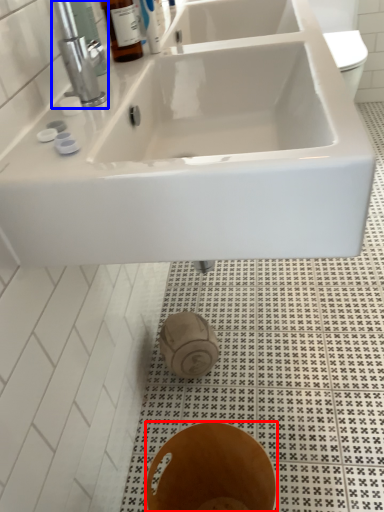
Question: Which object is closer to the camera taking this photo, bidet (highlighted by a red box) or tap (highlighted by a blue box)?

Choices:
 (A) bidet
 (B) tap

Answer: (A)